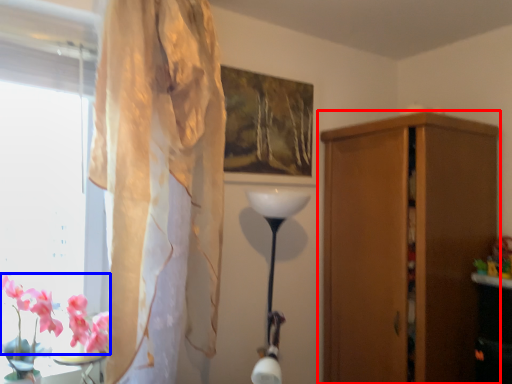
Question: Which point is closer to the camera, cupboard (highlighted by a red box) or flower (highlighted by a blue box)?

Choices:
 (A) cupboard
 (B) flower

Answer: (B)